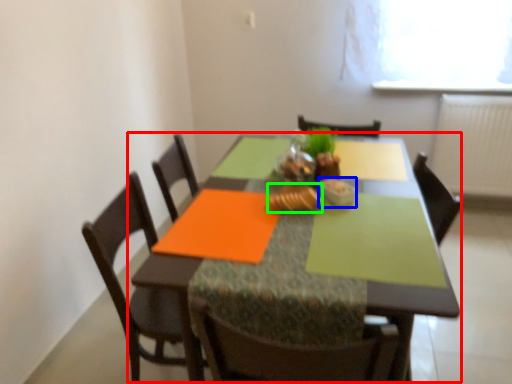
Question: Considering the real-world distances, which object is farthest from kitchen & dining room table (highlighted by a red box)? tableware (highlighted by a blue box) or food (highlighted by a green box)?

Choices:
 (A) tableware
 (B) food

Answer: (A)